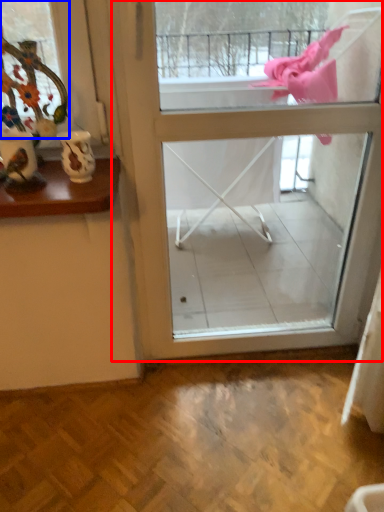
Question: Which of the following is the closest to the observer, screen door (highlighted by a red box) or window (highlighted by a blue box)?

Choices:
 (A) screen door
 (B) window

Answer: (B)